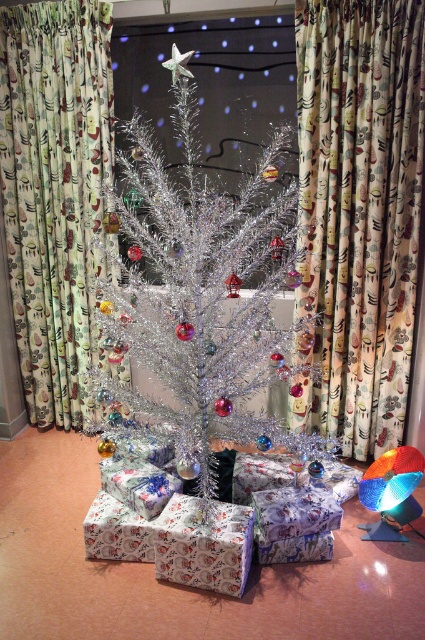
You are a guest at a holiday party and want to take a photo of the shiny metallic tree at center without the floral fabric curtain at center appearing in the frame. Is it possible to do so by adjusting your camera angle?

The floral fabric curtain at center is above the shiny metallic tree at center, so if you angle your camera downward while focusing on the tree, you can avoid capturing the curtain in the frame.

You are a guest at a holiday party and want to take a photo of the shiny metallic tree at center without any distractions. Since the floral fabric curtain at left is in the background, will it block the view of the tree?

The shiny metallic tree at center is positioned under the floral fabric curtain at left, so the curtain will block part of the tree in the photo.

You are a delivery person who just arrived at a house with a festive Christmas setup. You need to place a new package that is 2 feet wide between the shiny metallic tree at center and the floral fabric curtain at left. Is there enough space to fit the package between them?

The shiny metallic tree at center and floral fabric curtain at left are 26.65 inches apart. Since 26.65 inches is approximately 2.22 feet, which is wider than the package that is 2 feet wide, there is enough space to fit the package between them.